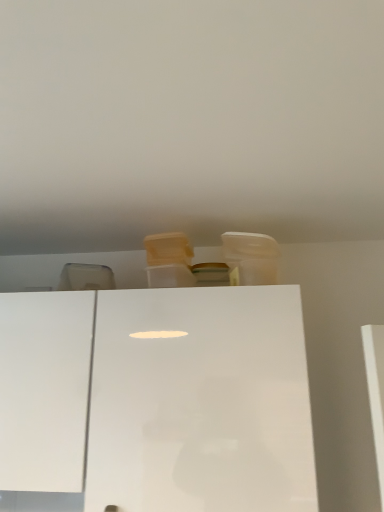
I want to click on white glossy cabinet at center, so click(200, 402).

What do you see at coordinates (200, 402) in the screenshot? The height and width of the screenshot is (512, 384). I see `white glossy cabinet at center` at bounding box center [200, 402].

I want to click on white glossy cabinet at center, so click(x=200, y=402).